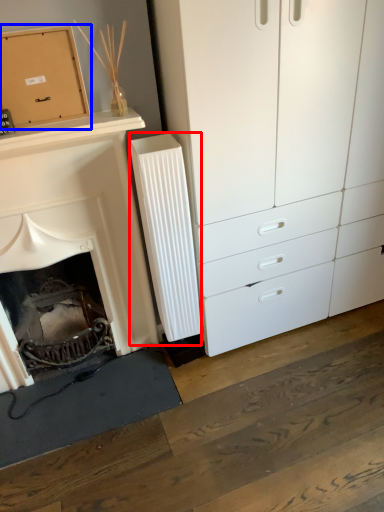
Question: Which point is closer to the camera, radiator (highlighted by a red box) or cardboard box (highlighted by a blue box)?

Choices:
 (A) radiator
 (B) cardboard box

Answer: (B)